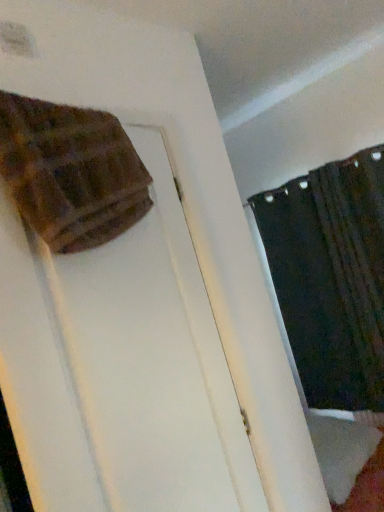
Question: Is brown textured blanket at upper left completely or partially outside of black textured curtain at upper right?

Choices:
 (A) yes
 (B) no

Answer: (A)

Question: Can you confirm if brown textured blanket at upper left is thinner than black textured curtain at upper right?

Choices:
 (A) no
 (B) yes

Answer: (A)

Question: Does brown textured blanket at upper left appear on the right side of black textured curtain at upper right?

Choices:
 (A) yes
 (B) no

Answer: (B)

Question: Does brown textured blanket at upper left have a lesser height compared to black textured curtain at upper right?

Choices:
 (A) yes
 (B) no

Answer: (A)

Question: Would you say brown textured blanket at upper left contains black textured curtain at upper right?

Choices:
 (A) no
 (B) yes

Answer: (A)

Question: Are brown textured blanket at upper left and black textured curtain at upper right making contact?

Choices:
 (A) yes
 (B) no

Answer: (B)

Question: From a real-world perspective, is black textured curtain at upper right below brown textured blanket at upper left?

Choices:
 (A) yes
 (B) no

Answer: (A)

Question: Is black textured curtain at upper right facing towards brown textured blanket at upper left?

Choices:
 (A) no
 (B) yes

Answer: (B)

Question: Are black textured curtain at upper right and brown textured blanket at upper left making contact?

Choices:
 (A) yes
 (B) no

Answer: (B)

Question: Considering the relative sizes of black textured curtain at upper right and brown textured blanket at upper left in the image provided, is black textured curtain at upper right shorter than brown textured blanket at upper left?

Choices:
 (A) yes
 (B) no

Answer: (B)

Question: Does black textured curtain at upper right appear on the left side of brown textured blanket at upper left?

Choices:
 (A) no
 (B) yes

Answer: (A)

Question: From the image's perspective, is black textured curtain at upper right below brown textured blanket at upper left?

Choices:
 (A) yes
 (B) no

Answer: (A)

Question: Considering the relative positions of black textured curtain at upper right and brown textured blanket at upper left in the image provided, is black textured curtain at upper right to the left or to the right of brown textured blanket at upper left?

Choices:
 (A) right
 (B) left

Answer: (A)